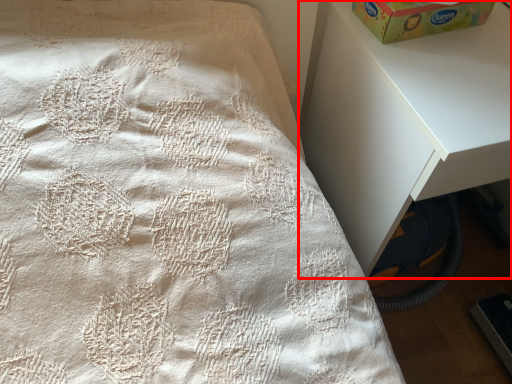
Question: In this image, where is nightstand (annotated by the red box) located relative to box?

Choices:
 (A) right
 (B) left

Answer: (A)